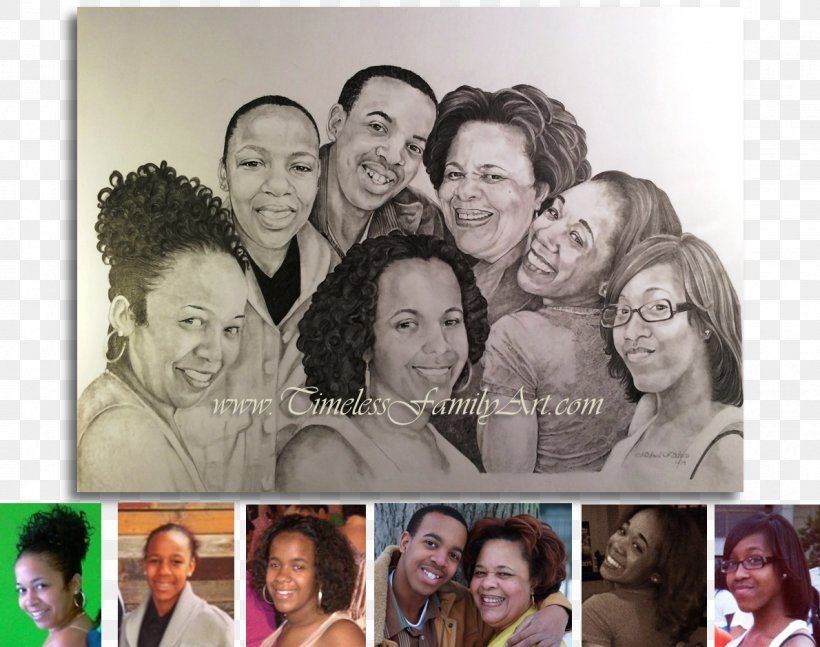
Where is `coat`? coat is located at coordinates (194, 627).